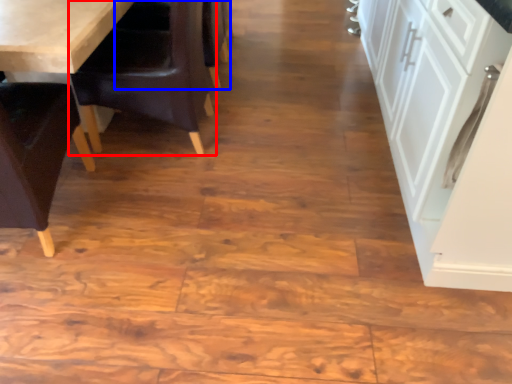
Question: Which object appears closest to the camera in this image, chair (highlighted by a red box) or armchair (highlighted by a blue box)?

Choices:
 (A) chair
 (B) armchair

Answer: (A)